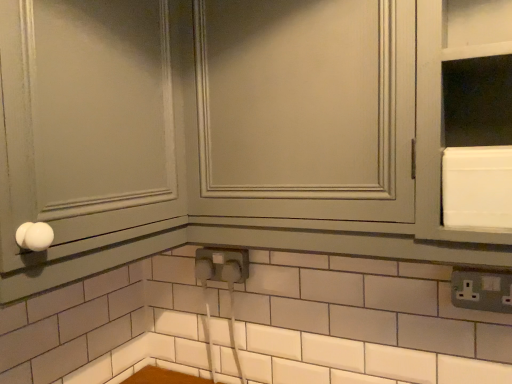
Where is `gray plastic electrical outlet at lower right`? gray plastic electrical outlet at lower right is located at coordinates (482, 290).

Describe the element at coordinates (482, 290) in the screenshot. I see `gray plastic electrical outlet at lower right` at that location.

Describe the element at coordinates (85, 136) in the screenshot. I see `white glossy knob at left` at that location.

The height and width of the screenshot is (384, 512). What do you see at coordinates (304, 109) in the screenshot? I see `white glossy cabinet at center` at bounding box center [304, 109].

At what (x,y) coordinates should I click in order to perform the action: click on gray plastic electrical outlet at lower right. Please return your answer as a coordinate pair (x, y). This screenshot has height=384, width=512. Looking at the image, I should click on (482, 290).

Considering the relative positions of white glossy cabinet at center and white glossy knob at left in the image provided, is white glossy cabinet at center in front of white glossy knob at left?

No, the depth of white glossy cabinet at center is greater than that of white glossy knob at left.

This screenshot has height=384, width=512. I want to click on window behind the white glossy knob at left, so click(304, 109).

Which of these two, white glossy cabinet at center or white glossy knob at left, is smaller?

Smaller between the two is white glossy cabinet at center.

Can you confirm if white glossy knob at left is wider than gray plastic electrical outlet at lower right?

Yes.

From the image's perspective, is white glossy knob at left under gray plastic electrical outlet at lower right?

No, from the image's perspective, white glossy knob at left is not below gray plastic electrical outlet at lower right.

Is white glossy knob at left at the left side of gray plastic electrical outlet at lower right?

Correct, you'll find white glossy knob at left to the left of gray plastic electrical outlet at lower right.

Considering the relative sizes of white glossy knob at left and gray plastic electrical outlet at lower right in the image provided, is white glossy knob at left shorter than gray plastic electrical outlet at lower right?

In fact, white glossy knob at left may be taller than gray plastic electrical outlet at lower right.

Looking at this image, is gray plastic electrical outlet at lower right wider than white glossy cabinet at center?

Incorrect, the width of gray plastic electrical outlet at lower right does not surpass that of white glossy cabinet at center.

From a real-world perspective, which object rests below the other?

gray plastic electrical outlet at lower right, from a real-world perspective.

From the image's perspective, which is below, gray plastic electrical outlet at lower right or white glossy cabinet at center?

From the image's view, gray plastic electrical outlet at lower right is below.

Is gray plastic electrical outlet at lower right at the right side of white glossy knob at left?

Indeed, gray plastic electrical outlet at lower right is positioned on the right side of white glossy knob at left.

From their relative heights in the image, would you say gray plastic electrical outlet at lower right is taller or shorter than white glossy knob at left?

In the image, gray plastic electrical outlet at lower right appears to be shorter than white glossy knob at left.

Is gray plastic electrical outlet at lower right inside or outside of white glossy knob at left?

gray plastic electrical outlet at lower right is outside white glossy knob at left.

How many degrees apart are the facing directions of gray plastic electrical outlet at lower right and white glossy knob at left?

They differ by 89.3 degrees in their facing directions.

Is gray plastic electrical outlet at lower right at the back of white glossy cabinet at center?

No, white glossy cabinet at center is not facing away from gray plastic electrical outlet at lower right.

Locate an element on the screen. The image size is (512, 384). window above the gray plastic electrical outlet at lower right (from the image's perspective) is located at coordinates (304, 109).

Which object is wider, white glossy cabinet at center or gray plastic electrical outlet at lower right?

white glossy cabinet at center.

Between white glossy knob at left and white glossy cabinet at center, which one is positioned in front?

Positioned in front is white glossy knob at left.

Which is more to the right, white glossy knob at left or white glossy cabinet at center?

white glossy cabinet at center is more to the right.

How different are the orientations of white glossy knob at left and white glossy cabinet at center in degrees?

89 degrees separate the facing orientations of white glossy knob at left and white glossy cabinet at center.

In terms of height, does white glossy knob at left look taller or shorter compared to white glossy cabinet at center?

In the image, white glossy knob at left appears to be taller than white glossy cabinet at center.

You are a GUI agent. You are given a task and a screenshot of the screen. Output one action in this format:
    pyautogui.click(x=<x>, y=<y>)
    Task: Click on the screen door that is above the white glossy cabinet at center (from a real-world perspective)
    Image resolution: width=512 pixels, height=384 pixels.
    Given the screenshot: What is the action you would take?
    pyautogui.click(x=85, y=136)

Where is `electric outlet that appears on the right of white glossy knob at left`? The height and width of the screenshot is (384, 512). electric outlet that appears on the right of white glossy knob at left is located at coordinates (482, 290).

When comparing their distances from white glossy knob at left, does gray plastic electrical outlet at lower right or white glossy cabinet at center seem closer?

white glossy cabinet at center is closer to white glossy knob at left.

Estimate the real-world distances between objects in this image. Which object is closer to gray plastic electrical outlet at lower right, white glossy cabinet at center or white glossy knob at left?

white glossy cabinet at center is positioned closer to the anchor gray plastic electrical outlet at lower right.

Estimate the real-world distances between objects in this image. Which object is further from white glossy cabinet at center, white glossy knob at left or gray plastic electrical outlet at lower right?

gray plastic electrical outlet at lower right is further to white glossy cabinet at center.

Looking at the image, which one is located closer to white glossy cabinet at center, gray plastic electrical outlet at lower right or white glossy knob at left?

Among the two, white glossy knob at left is located nearer to white glossy cabinet at center.

From the image, which object appears to be farther from white glossy knob at left, white glossy cabinet at center or gray plastic electrical outlet at lower right?

gray plastic electrical outlet at lower right is further to white glossy knob at left.

From the picture: Estimate the real-world distances between objects in this image. Which object is further from gray plastic electrical outlet at lower right, white glossy knob at left or white glossy cabinet at center?

white glossy knob at left is positioned further to the anchor gray plastic electrical outlet at lower right.

This screenshot has width=512, height=384. Identify the location of window between white glossy knob at left and gray plastic electrical outlet at lower right in the horizontal direction. (304, 109).